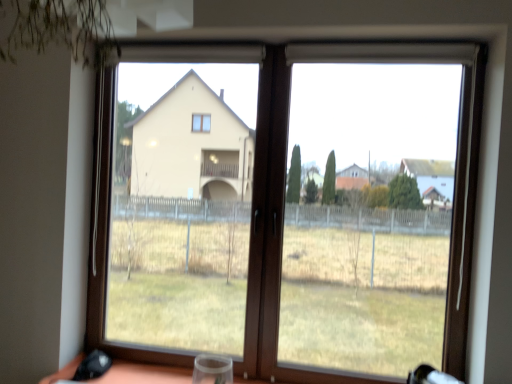
At what (x,y) coordinates should I click in order to perform the action: click on brown wooden window at center. Please return your answer as a coordinate pair (x, y). Looking at the image, I should click on (289, 211).

What do you see at coordinates (289, 211) in the screenshot?
I see `brown wooden window at center` at bounding box center [289, 211].

Identify the location of transparent plastic wine glass at bottom center. The height and width of the screenshot is (384, 512). (212, 369).

What do you see at coordinates (212, 369) in the screenshot?
I see `transparent plastic wine glass at bottom center` at bounding box center [212, 369].

Where is `brown wooden window at center`? This screenshot has height=384, width=512. brown wooden window at center is located at coordinates (289, 211).

Looking at this image, does brown wooden window at center appear on the left side of transparent plastic wine glass at bottom center?

No.

Relative to transparent plastic wine glass at bottom center, is brown wooden window at center in front or behind?

Visually, brown wooden window at center is located behind transparent plastic wine glass at bottom center.

Is point (143, 171) positioned after point (217, 363)?

That is True.

From the image's perspective, is brown wooden window at center located beneath transparent plastic wine glass at bottom center?

No, from the image's perspective, brown wooden window at center is not beneath transparent plastic wine glass at bottom center.

From a real-world perspective, which is physically above, brown wooden window at center or transparent plastic wine glass at bottom center?

In real-world perspective, brown wooden window at center is above.

Looking at their sizes, would you say brown wooden window at center is wider or thinner than transparent plastic wine glass at bottom center?

Considering their sizes, brown wooden window at center looks slimmer than transparent plastic wine glass at bottom center.

Does brown wooden window at center have a lesser height compared to transparent plastic wine glass at bottom center?

In fact, brown wooden window at center may be taller than transparent plastic wine glass at bottom center.

Considering the relative sizes of brown wooden window at center and transparent plastic wine glass at bottom center in the image provided, is brown wooden window at center bigger than transparent plastic wine glass at bottom center?

Yes.

Is brown wooden window at center surrounding transparent plastic wine glass at bottom center?

Actually, transparent plastic wine glass at bottom center is outside brown wooden window at center.

Is brown wooden window at center directly adjacent to transparent plastic wine glass at bottom center?

No, brown wooden window at center is not in contact with transparent plastic wine glass at bottom center.

Is brown wooden window at center positioned with its back to transparent plastic wine glass at bottom center?

No.

Can you tell me how much brown wooden window at center and transparent plastic wine glass at bottom center differ in facing direction?

The facing directions of brown wooden window at center and transparent plastic wine glass at bottom center are 1.02 degrees apart.

You are a GUI agent. You are given a task and a screenshot of the screen. Output one action in this format:
    pyautogui.click(x=<x>, y=<y>)
    Task: Click on the window above the transparent plastic wine glass at bottom center (from the image's perspective)
    The image size is (512, 384).
    Given the screenshot: What is the action you would take?
    pyautogui.click(x=289, y=211)

Between transparent plastic wine glass at bottom center and brown wooden window at center, which one appears on the right side from the viewer's perspective?

brown wooden window at center.

Which object is closer to the camera taking this photo, transparent plastic wine glass at bottom center or brown wooden window at center?

transparent plastic wine glass at bottom center is more forward.

Which is behind, point (223, 370) or point (355, 89)?

The point (355, 89) is more distant.

From the image's perspective, which object appears higher, transparent plastic wine glass at bottom center or brown wooden window at center?

brown wooden window at center appears higher in the image.

Looking at this image, from a real-world perspective, is transparent plastic wine glass at bottom center positioned above or below brown wooden window at center?

transparent plastic wine glass at bottom center is situated lower than brown wooden window at center in the real world.

Which object is thinner, transparent plastic wine glass at bottom center or brown wooden window at center?

With smaller width is brown wooden window at center.

Considering the relative sizes of transparent plastic wine glass at bottom center and brown wooden window at center in the image provided, is transparent plastic wine glass at bottom center shorter than brown wooden window at center?

Indeed, transparent plastic wine glass at bottom center has a lesser height compared to brown wooden window at center.

Between transparent plastic wine glass at bottom center and brown wooden window at center, which one has larger size?

brown wooden window at center.

Would you say transparent plastic wine glass at bottom center is inside or outside brown wooden window at center?

transparent plastic wine glass at bottom center exists outside the volume of brown wooden window at center.

Is transparent plastic wine glass at bottom center in contact with brown wooden window at center?

No, transparent plastic wine glass at bottom center is not making contact with brown wooden window at center.

Is transparent plastic wine glass at bottom center aimed at brown wooden window at center?

No, transparent plastic wine glass at bottom center does not turn towards brown wooden window at center.

How different are the orientations of transparent plastic wine glass at bottom center and brown wooden window at center in degrees?

1.02 degrees.

Locate an element on the screen. The image size is (512, 384). wine glass in front of the brown wooden window at center is located at coordinates (212, 369).

Locate an element on the screen. This screenshot has width=512, height=384. wine glass in front of the brown wooden window at center is located at coordinates (212, 369).

Identify the location of window behind the transparent plastic wine glass at bottom center. (289, 211).